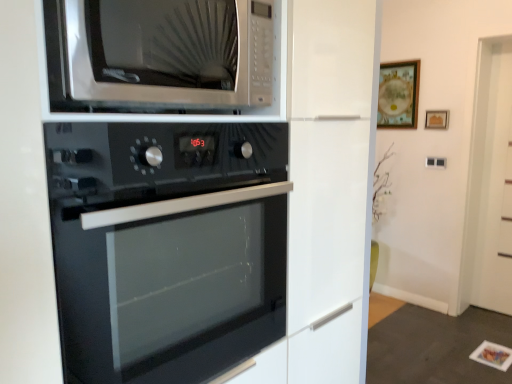
Question: Is there a large distance between black glass oven at center and wooden frame at upper center, which is the first picture frame in right-to-left order?

Choices:
 (A) yes
 (B) no

Answer: (A)

Question: From a real-world perspective, is black glass oven at center physically below wooden frame at upper center, which is the first picture frame in right-to-left order?

Choices:
 (A) yes
 (B) no

Answer: (A)

Question: Considering the relative sizes of black glass oven at center and wooden frame at upper center, which is the first picture frame in right-to-left order, in the image provided, is black glass oven at center taller than wooden frame at upper center, which is the first picture frame in right-to-left order,?

Choices:
 (A) no
 (B) yes

Answer: (B)

Question: Does black glass oven at center turn towards wooden frame at upper center, acting as the second picture frame starting from the left?

Choices:
 (A) yes
 (B) no

Answer: (B)

Question: From a real-world perspective, is black glass oven at center located higher than wooden frame at upper center, acting as the second picture frame starting from the left?

Choices:
 (A) yes
 (B) no

Answer: (B)

Question: Is black glass oven at center behind wooden frame at upper center, acting as the second picture frame starting from the left?

Choices:
 (A) no
 (B) yes

Answer: (A)

Question: Is satin silver microwave at upper center located outside wooden framed picture at upper right, the 1th picture frame viewed from the left?

Choices:
 (A) yes
 (B) no

Answer: (A)

Question: From a real-world perspective, is satin silver microwave at upper center located beneath wooden framed picture at upper right, the 1th picture frame viewed from the left?

Choices:
 (A) yes
 (B) no

Answer: (A)

Question: Is the depth of satin silver microwave at upper center greater than that of wooden framed picture at upper right, the 2th picture frame when ordered from right to left?

Choices:
 (A) no
 (B) yes

Answer: (A)

Question: Considering the relative sizes of satin silver microwave at upper center and wooden framed picture at upper right, the 2th picture frame when ordered from right to left, in the image provided, is satin silver microwave at upper center taller than wooden framed picture at upper right, the 2th picture frame when ordered from right to left,?

Choices:
 (A) no
 (B) yes

Answer: (A)

Question: Are satin silver microwave at upper center and wooden framed picture at upper right, the 2th picture frame when ordered from right to left, beside each other?

Choices:
 (A) no
 (B) yes

Answer: (A)

Question: Considering the relative positions of satin silver microwave at upper center and wooden framed picture at upper right, the 2th picture frame when ordered from right to left, in the image provided, is satin silver microwave at upper center to the left of wooden framed picture at upper right, the 2th picture frame when ordered from right to left, from the viewer's perspective?

Choices:
 (A) yes
 (B) no

Answer: (A)

Question: Is black glass oven at center positioned in front of satin silver microwave at upper center?

Choices:
 (A) yes
 (B) no

Answer: (B)